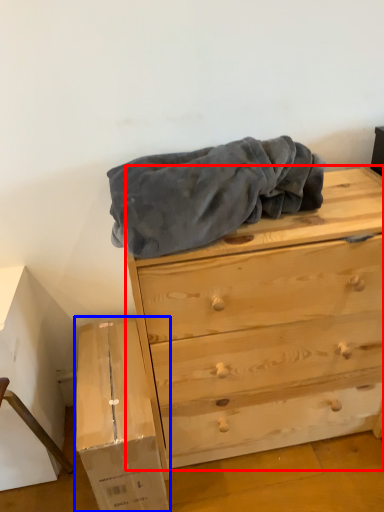
Question: Which point is closer to the camera, chest of drawers (highlighted by a red box) or cardboard box (highlighted by a blue box)?

Choices:
 (A) chest of drawers
 (B) cardboard box

Answer: (A)